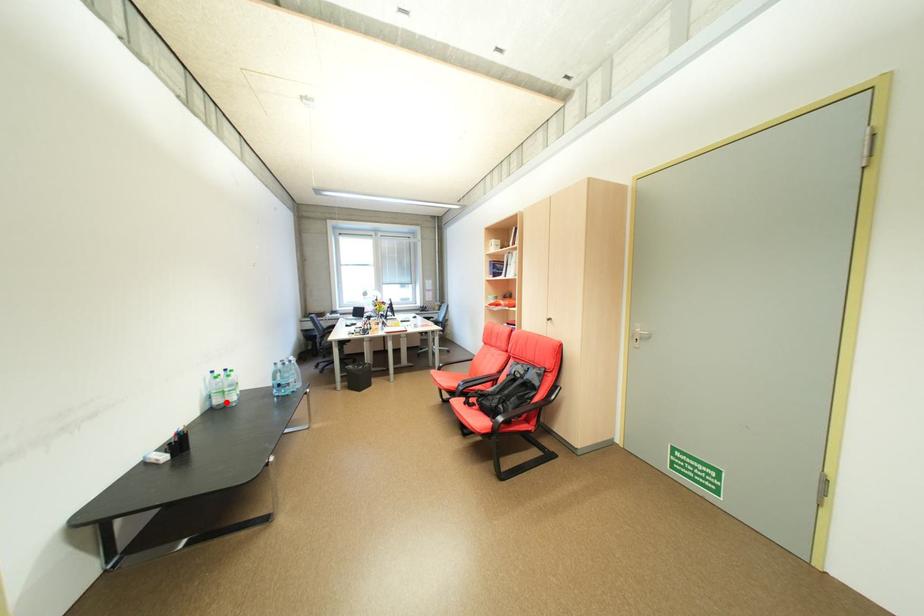
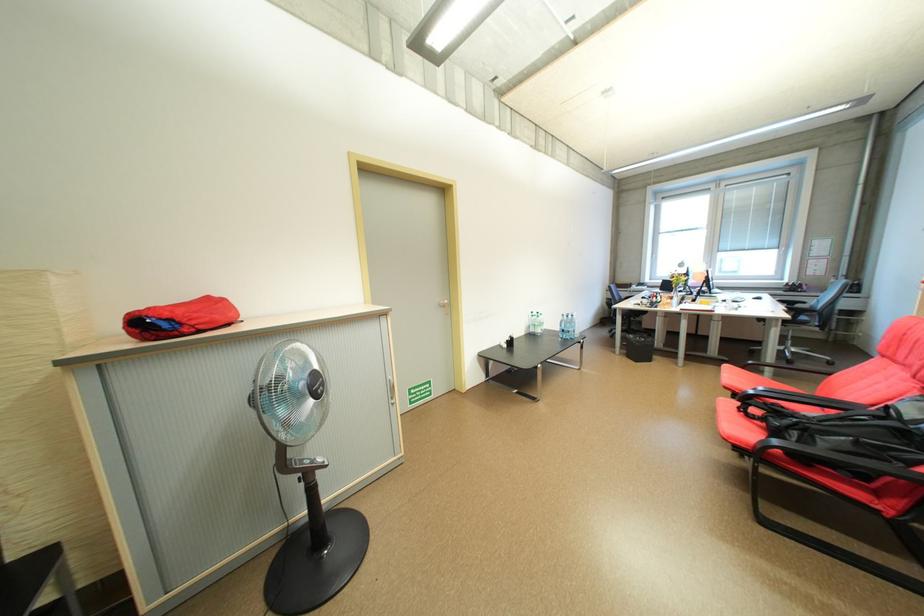
Locate, in the second image, the point that corresponds to the highlighted location in the first image.

(541, 331)